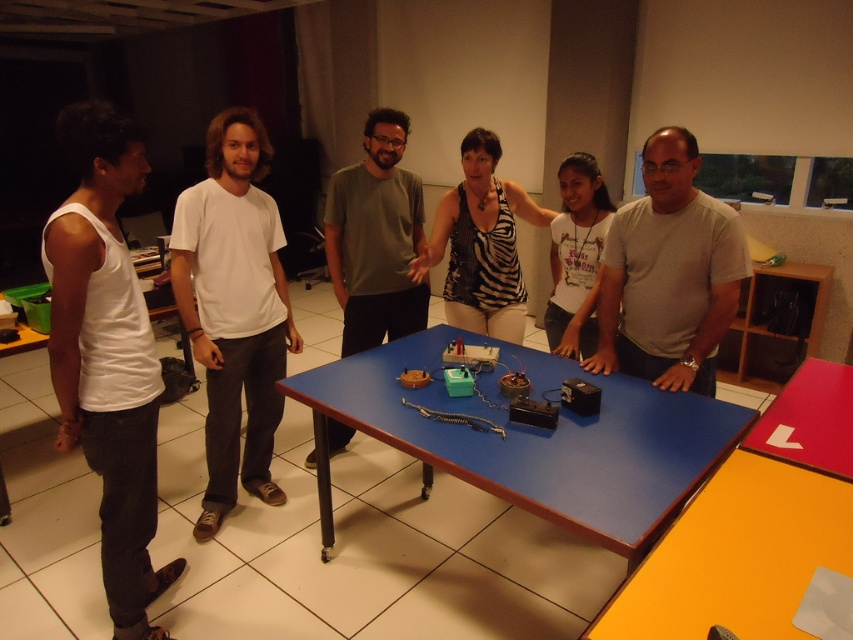
You are standing at the center of the room and looking towards the rectangular blue table. There are two points marked on the table surface at coordinates point [84,228] and point [619,225]. Which point is closer to you?

Point [84,228] is closer to the viewer than point [619,225].